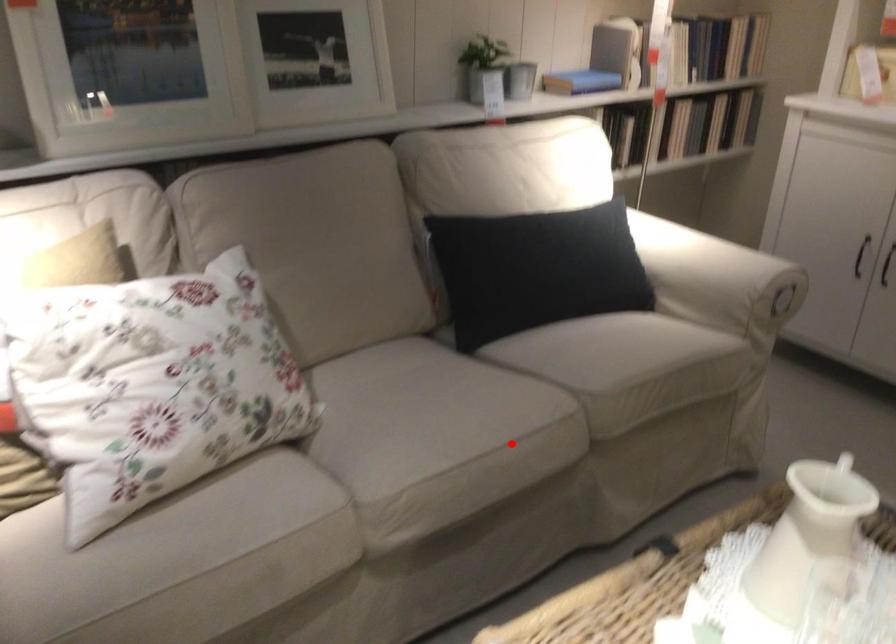
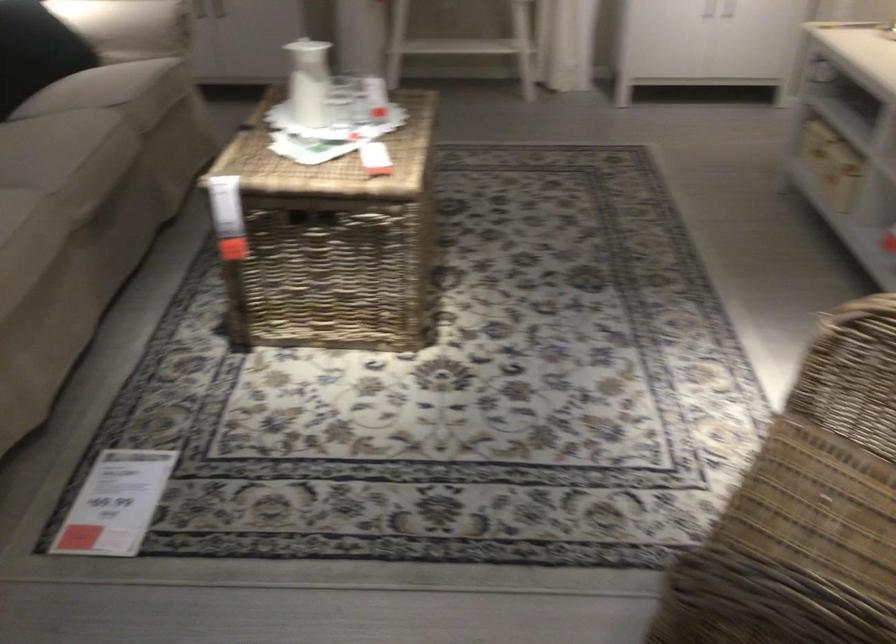
Question: I am providing you with two images of the same scene from different viewpoints. A red point is marked on the first image. Is the red point's position out of view in image 2?

Choices:
 (A) Yes
 (B) No

Answer: (B)